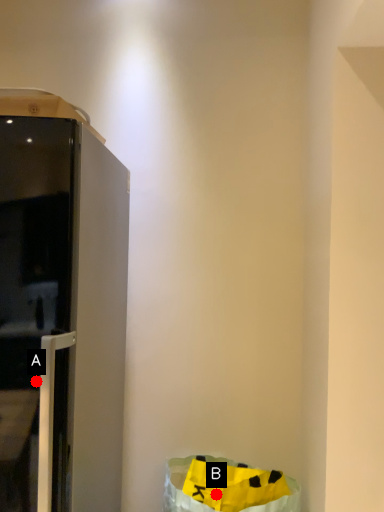
Question: Two points are circled on the image, labeled by A and B beside each circle. Which of the following is the closest to the observer?

Choices:
 (A) A is closer
 (B) B is closer

Answer: (A)